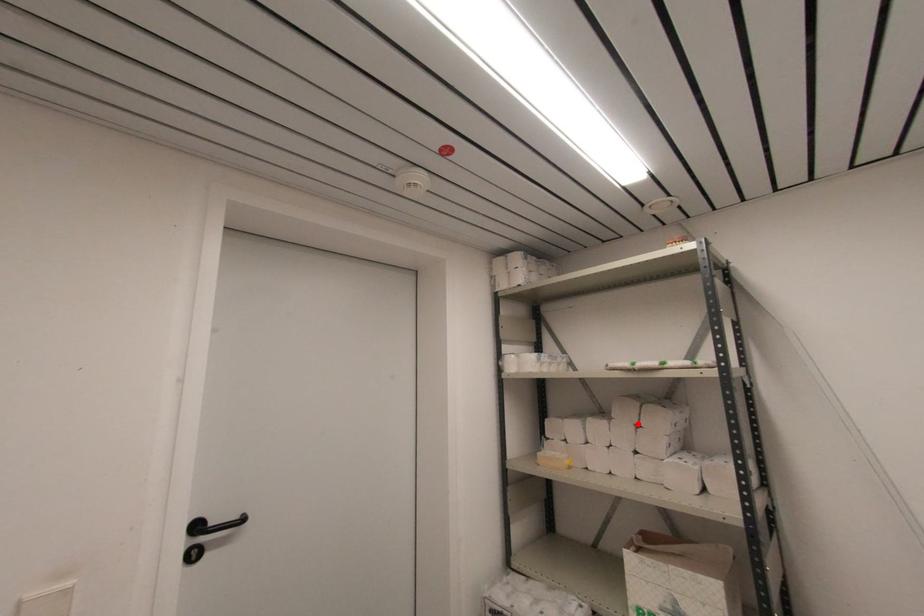
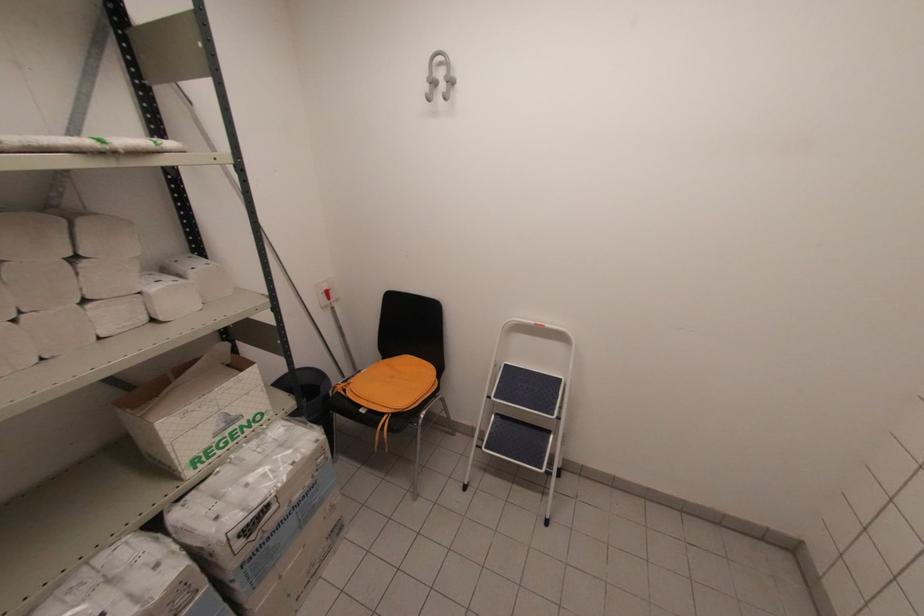
Where in the second image is the point corresponding to the highlighted location from the first image?

(71, 254)